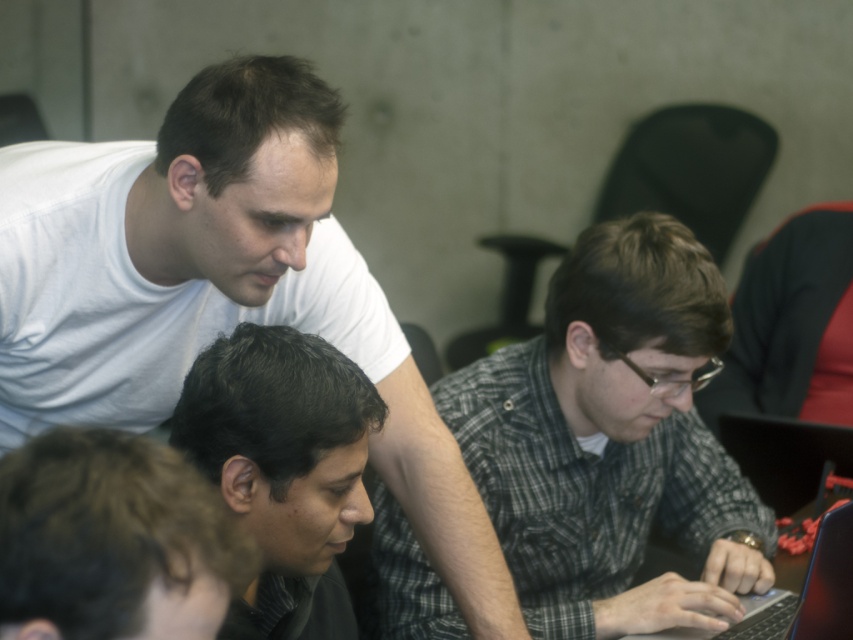
Question: Does checkered fabric shirt at center have a smaller size compared to dark brown hair at lower left?

Choices:
 (A) no
 (B) yes

Answer: (A)

Question: Can you confirm if dark brown hair at lower left is positioned below black glossy laptop at lower right?

Choices:
 (A) yes
 (B) no

Answer: (B)

Question: Which point is farther to the camera?

Choices:
 (A) (146, 337)
 (B) (442, 616)
 (C) (190, 416)

Answer: (B)

Question: Among these objects, which one is farthest from the camera?

Choices:
 (A) checkered fabric shirt at center
 (B) white matte shirt at upper left
 (C) black glossy laptop at lower right
 (D) dark gray checkered shirt at lower center

Answer: (C)

Question: Which point is closer to the camera?

Choices:
 (A) (131, 554)
 (B) (426, 552)
 (C) (759, 621)
 (D) (276, 336)

Answer: (A)

Question: From the image, what is the correct spatial relationship of white matte shirt at upper left in relation to dark gray checkered shirt at lower center?

Choices:
 (A) above
 (B) below

Answer: (A)